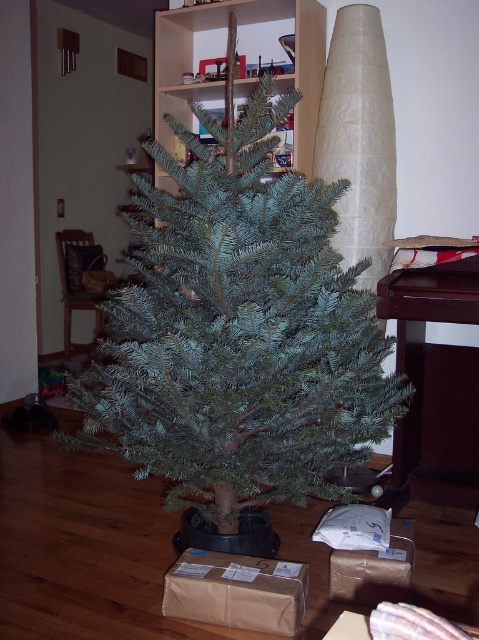
Is point (167, 614) closer to viewer compared to point (392, 536)?

That is True.

Describe the element at coordinates (237, 592) in the screenshot. I see `brown paper box at center` at that location.

Locate an element on the screen. The height and width of the screenshot is (640, 479). brown paper box at center is located at coordinates (237, 592).

Does green matte christmas tree at center appear under brown paper box at center?

No, green matte christmas tree at center is not below brown paper box at center.

Is green matte christmas tree at center taller than brown paper box at center?

Yes, green matte christmas tree at center is taller than brown paper box at center.

Does point (243, 150) come closer to viewer compared to point (287, 595)?

No, (243, 150) is further to viewer.

Identify the location of green matte christmas tree at center. This screenshot has height=640, width=479. (239, 332).

Which of these two, green matte christmas tree at center or brown cardboard box at lower center, stands shorter?

Standing shorter between the two is brown cardboard box at lower center.

The width and height of the screenshot is (479, 640). Describe the element at coordinates (239, 332) in the screenshot. I see `green matte christmas tree at center` at that location.

The image size is (479, 640). Identify the location of green matte christmas tree at center. (239, 332).